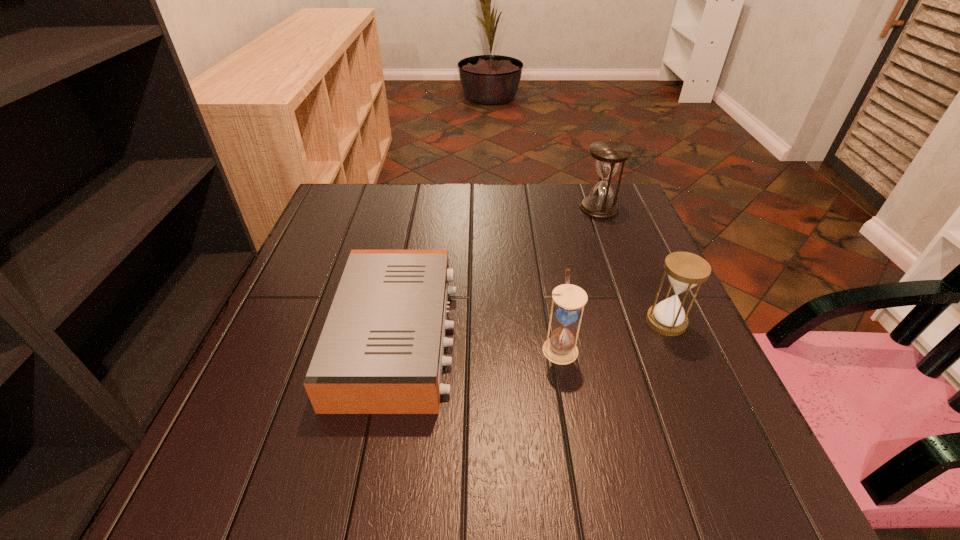
Image resolution: width=960 pixels, height=540 pixels. In the image, there is a desktop. Identify the location of free region at the far edge. (468, 191).

Where is `free region at the near edge of the desktop`? The width and height of the screenshot is (960, 540). free region at the near edge of the desktop is located at coordinates (639, 504).

In the image, there is a desktop. Identify the location of vacant space at the left edge. (303, 264).

I want to click on vacant space at the right edge of the desktop, so click(695, 397).

In the image, there is a desktop. Where is `free region at the far left corner`? Image resolution: width=960 pixels, height=540 pixels. free region at the far left corner is located at coordinates (324, 210).

In the image, there is a desktop. At what (x,y) coordinates should I click in order to perform the action: click on vacant region at the near left corner. Please return your answer as a coordinate pair (x, y). The width and height of the screenshot is (960, 540). Looking at the image, I should click on (199, 504).

The width and height of the screenshot is (960, 540). In the image, there is a desktop. In order to click on free region at the near right corner in this screenshot , I will do `click(725, 463)`.

Locate an element on the screen. The image size is (960, 540). free point between the leftmost object and the farthest hourglass is located at coordinates (498, 272).

Identify the location of vacant area that lies between the farthest hourglass and the second object from left to right. This screenshot has height=540, width=960. (580, 278).

Locate an element on the screen. the third closest object to the leftmost hourglass is located at coordinates (608, 155).